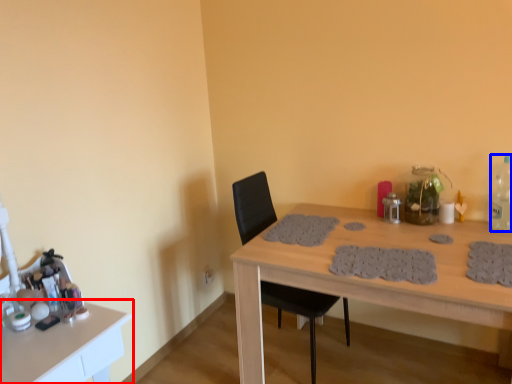
Question: Which of the following is the closest to the observer, table (highlighted by a red box) or bottle (highlighted by a blue box)?

Choices:
 (A) table
 (B) bottle

Answer: (A)